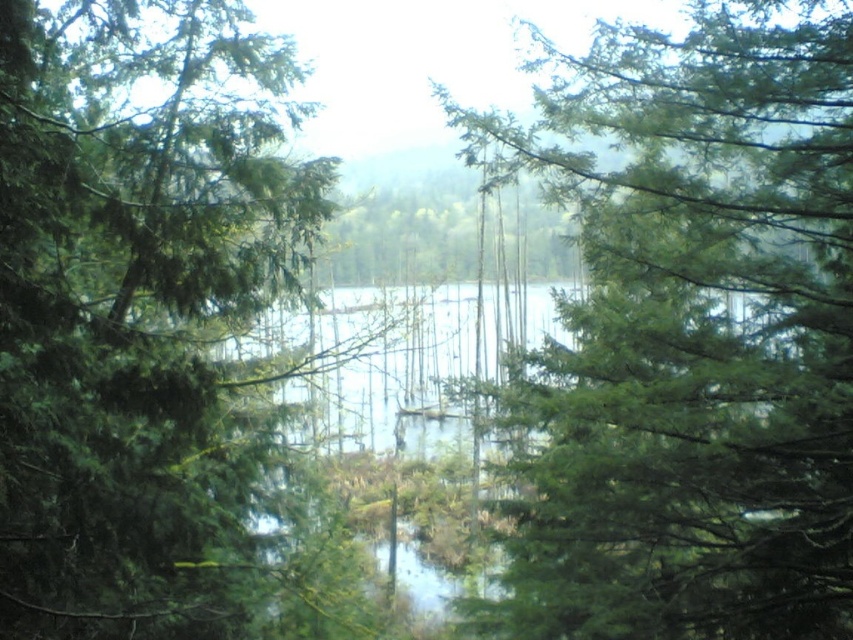
Looking at this image, you are a hiker standing in the forest and see the green leafy tree at center and the green matte tree at left. Which tree would you have to look up higher to see the top of?

The green leafy tree at center is much taller than the green matte tree at left, so you would have to look up higher to see the top of the green leafy tree at center.

You are planning to plant a new tree in this area. The green leafy tree at center and the green matte tree at left are already present. Which existing tree should you consider for spacing if you want to plant a new tree that requires more space?

The green leafy tree at center might require more space due to its wider width compared to the green matte tree at left, so you should consider its spacing when planting the new tree.

You are standing in the forest and see the green leafy tree at center and the green matte tree at left. Which tree is closer to the ground?

The green leafy tree at center is located below the green matte tree at left, so it is closer to the ground.